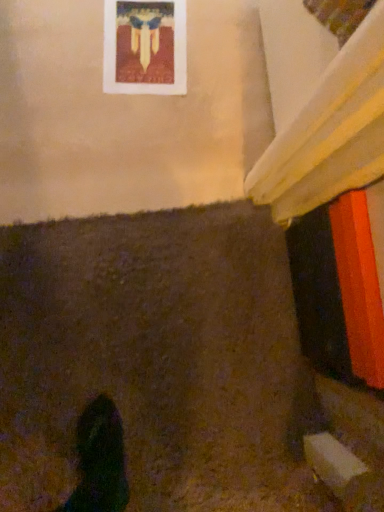
What are the coordinates of `blank space above matte paper picture frame at upper center (from a real-world perspective)` in the screenshot? It's located at (142, 35).